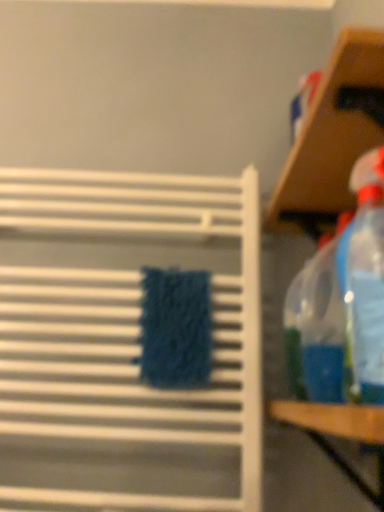
Question: From a real-world perspective, is wooden table at right above or below white textured towel rack at center, the second shelf when ordered from right to left?

Choices:
 (A) above
 (B) below

Answer: (B)

Question: From the image's perspective, is wooden table at right positioned above or below white textured towel rack at center, which is the 1th shelf in left-to-right order?

Choices:
 (A) above
 (B) below

Answer: (B)

Question: Which object is the farthest from the blue fuzzy beach towel at center?

Choices:
 (A) wooden table at right
 (B) transparent plastic shelf at upper right, marked as the 2th shelf in a left-to-right arrangement
 (C) white textured towel rack at center, which is the 1th shelf in left-to-right order
 (D) transparent plastic spray bottle at right

Answer: (B)

Question: Which object is the closest to the blue fuzzy beach towel at center?

Choices:
 (A) transparent plastic shelf at upper right, marked as the 2th shelf in a left-to-right arrangement
 (B) transparent plastic spray bottle at right
 (C) white textured towel rack at center, the second shelf when ordered from right to left
 (D) wooden table at right

Answer: (C)